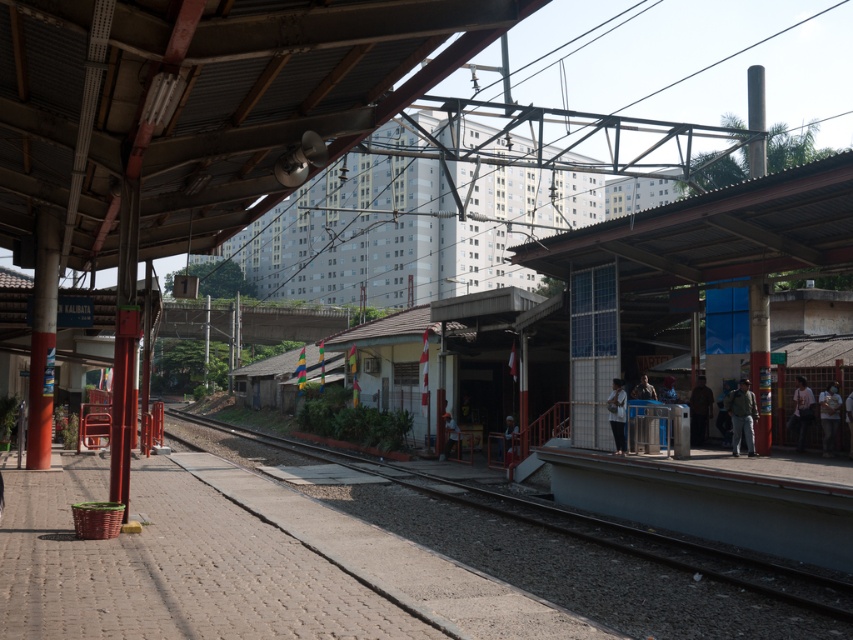
Can you confirm if khaki fabric jacket at right is positioned to the right of light brown leather jacket at right?

No, khaki fabric jacket at right is not to the right of light brown leather jacket at right.

Who is more distant from viewer, (x=746, y=420) or (x=798, y=420)?

The point (x=798, y=420) is behind.

At what (x,y) coordinates should I click in order to perform the action: click on khaki fabric jacket at right. Please return your answer as a coordinate pair (x, y). Image resolution: width=853 pixels, height=640 pixels. Looking at the image, I should click on (741, 416).

Can you confirm if dark brown jacket at right is positioned below orange fabric hat at center?

No.

Between dark brown jacket at right and orange fabric hat at center, which one is positioned lower?

orange fabric hat at center is below.

Does point (705, 410) come in front of point (448, 413)?

Yes, point (705, 410) is closer to viewer.

The width and height of the screenshot is (853, 640). I want to click on dark brown jacket at right, so click(700, 410).

Does point (648, 570) come closer to viewer compared to point (514, 433)?

Yes, point (648, 570) is closer to viewer.

Does brown gravel track at center have a lesser height compared to light brown wooden chair at center?

No.

Which is in front, point (489, 560) or point (509, 417)?

Positioned in front is point (489, 560).

Locate an element on the screen. This screenshot has height=640, width=853. brown gravel track at center is located at coordinates (549, 564).